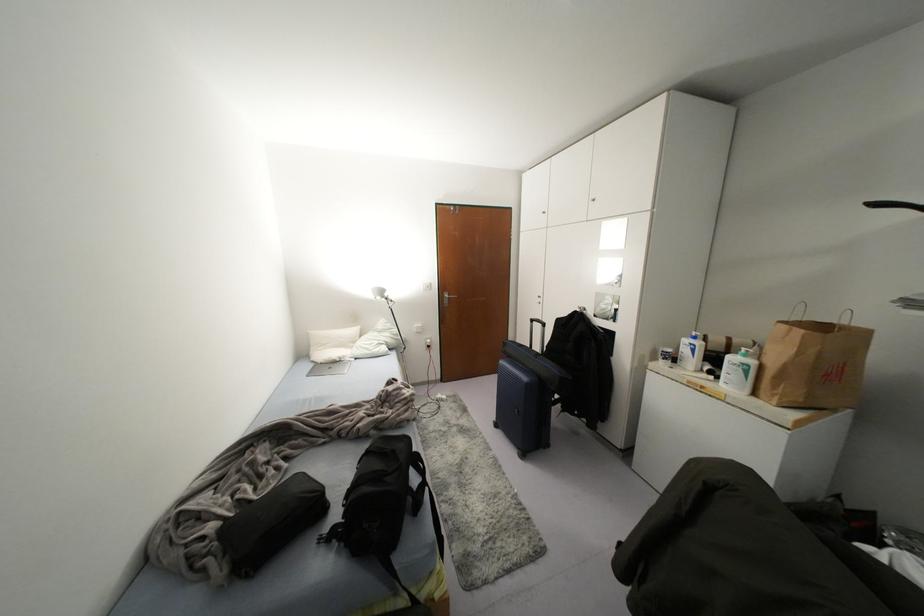
Which object does [332,344] point to?

It refers to a white pillow.